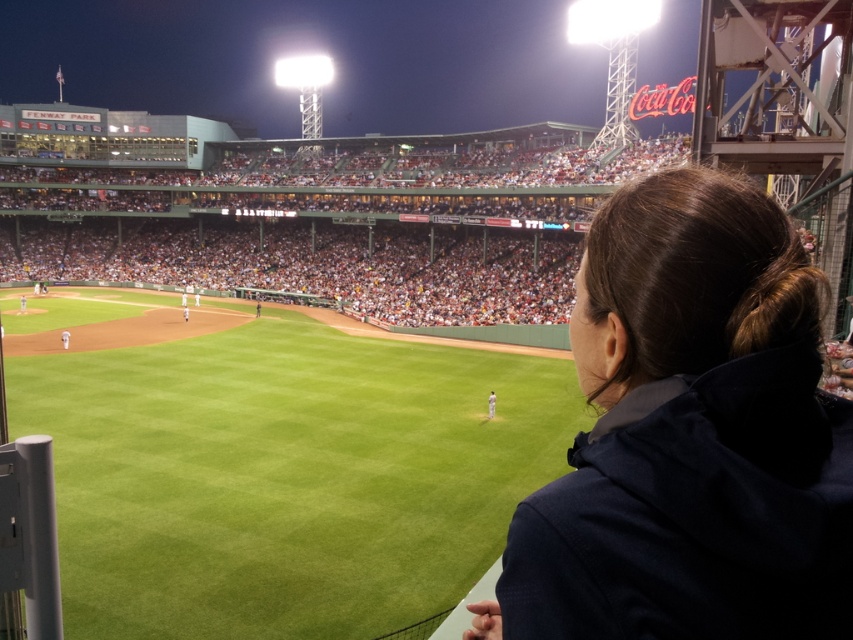
Is dark blue jacket at upper right smaller than green grass baseball field at center?

Indeed, dark blue jacket at upper right has a smaller size compared to green grass baseball field at center.

Between point (827, 472) and point (125, 234), which one is positioned in front?

Positioned in front is point (827, 472).

Between point (561, 557) and point (347, 196), which one is positioned in front?

Point (561, 557) is in front.

You are a GUI agent. You are given a task and a screenshot of the screen. Output one action in this format:
    pyautogui.click(x=<x>, y=<y>)
    Task: Click on the dark blue jacket at upper right
    This screenshot has height=640, width=853.
    Given the screenshot: What is the action you would take?
    pyautogui.click(x=689, y=436)

Between point (793, 394) and point (488, 413), which one is positioned in front?

Point (793, 394) is more forward.

Based on the photo, between dark blue jacket at upper right and white jersey uniform at center, which one is positioned higher?

Positioned higher is dark blue jacket at upper right.

Does point (735, 308) come behind point (491, 413)?

No, (735, 308) is closer to viewer.

Where is `dark blue jacket at upper right`? dark blue jacket at upper right is located at coordinates (689, 436).

Is point (479, 301) positioned in front of point (492, 392)?

No, (479, 301) is further to viewer.

Who is shorter, green grass baseball field at center or white jersey uniform at center?

white jersey uniform at center

The width and height of the screenshot is (853, 640). Describe the element at coordinates (334, 220) in the screenshot. I see `green grass baseball field at center` at that location.

The width and height of the screenshot is (853, 640). Identify the location of green grass baseball field at center. (334, 220).